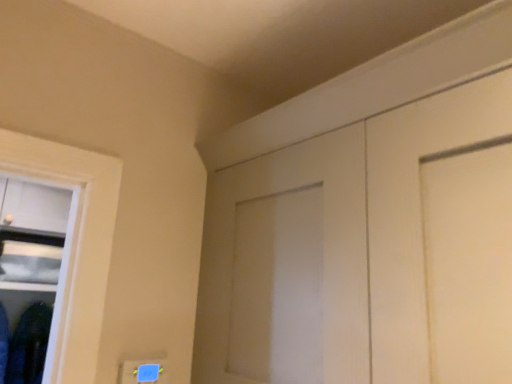
What are the coordinates of `white matte door at upper right` in the screenshot? It's located at (366, 251).

The image size is (512, 384). What do you see at coordinates (366, 251) in the screenshot? I see `white matte door at upper right` at bounding box center [366, 251].

What do you see at coordinates (29, 345) in the screenshot?
I see `dark blue fabric at lower left` at bounding box center [29, 345].

The height and width of the screenshot is (384, 512). I want to click on dark blue fabric at lower left, so click(29, 345).

You are a GUI agent. You are given a task and a screenshot of the screen. Output one action in this format:
    pyautogui.click(x=<x>, y=<y>)
    Task: Click on the white matte door at upper right
    The width and height of the screenshot is (512, 384).
    Given the screenshot: What is the action you would take?
    pyautogui.click(x=366, y=251)

Considering the relative positions of dark blue fabric at lower left and white matte door at upper right in the image provided, is dark blue fabric at lower left to the right of white matte door at upper right from the viewer's perspective?

No.

Considering their positions, is dark blue fabric at lower left located in front of or behind white matte door at upper right?

In the image, dark blue fabric at lower left appears behind white matte door at upper right.

Is point (23, 363) in front of point (426, 260)?

No, (23, 363) is behind (426, 260).

From the image's perspective, does dark blue fabric at lower left appear higher than white matte door at upper right?

No.

From a real-world perspective, is dark blue fabric at lower left on white matte door at upper right?

No.

Does dark blue fabric at lower left have a greater width compared to white matte door at upper right?

Incorrect, the width of dark blue fabric at lower left does not surpass that of white matte door at upper right.

Considering the relative sizes of dark blue fabric at lower left and white matte door at upper right in the image provided, is dark blue fabric at lower left shorter than white matte door at upper right?

Indeed, dark blue fabric at lower left has a lesser height compared to white matte door at upper right.

From the picture: Considering the relative sizes of dark blue fabric at lower left and white matte door at upper right in the image provided, is dark blue fabric at lower left smaller than white matte door at upper right?

Correct, dark blue fabric at lower left occupies less space than white matte door at upper right.

Is white matte door at upper right surrounded by dark blue fabric at lower left?

No, white matte door at upper right is not inside dark blue fabric at lower left.

Are dark blue fabric at lower left and white matte door at upper right located far from each other?

Absolutely, dark blue fabric at lower left is distant from white matte door at upper right.

Is dark blue fabric at lower left facing towards white matte door at upper right?

Yes, dark blue fabric at lower left is turned towards white matte door at upper right.

How much distance is there between dark blue fabric at lower left and white matte door at upper right?

They are 2.10 meters apart.

Where is `clothing located on the left of white matte door at upper right`? The width and height of the screenshot is (512, 384). clothing located on the left of white matte door at upper right is located at coordinates (29, 345).

Which object is positioned more to the right, white matte door at upper right or dark blue fabric at lower left?

From the viewer's perspective, white matte door at upper right appears more on the right side.

Which object is further away from the camera, white matte door at upper right or dark blue fabric at lower left?

dark blue fabric at lower left.

Which is behind, point (227, 259) or point (9, 378)?

The point (9, 378) is behind.

From the image's perspective, is white matte door at upper right positioned above or below dark blue fabric at lower left?

From the image's perspective, white matte door at upper right appears above dark blue fabric at lower left.

From a real-world perspective, is white matte door at upper right physically above dark blue fabric at lower left?

Yes.

Which of these two, white matte door at upper right or dark blue fabric at lower left, is wider?

With larger width is white matte door at upper right.

Can you confirm if white matte door at upper right is shorter than dark blue fabric at lower left?

No, white matte door at upper right is not shorter than dark blue fabric at lower left.

Is white matte door at upper right smaller than dark blue fabric at lower left?

Incorrect, white matte door at upper right is not smaller in size than dark blue fabric at lower left.

Is white matte door at upper right located outside dark blue fabric at lower left?

white matte door at upper right lies outside dark blue fabric at lower left's area.

Can you see white matte door at upper right touching dark blue fabric at lower left?

white matte door at upper right is not next to dark blue fabric at lower left, and they're not touching.

Is white matte door at upper right facing away from dark blue fabric at lower left?

white matte door at upper right does not have its back to dark blue fabric at lower left.

How many degrees apart are the facing directions of white matte door at upper right and dark blue fabric at lower left?

The angular difference between white matte door at upper right and dark blue fabric at lower left is 90.6 degrees.

Find the location of a particular element. Image resolution: width=512 pixels, height=384 pixels. clothing beneath the white matte door at upper right (from a real-world perspective) is located at coordinates (29, 345).

Image resolution: width=512 pixels, height=384 pixels. I want to click on door in front of the dark blue fabric at lower left, so click(366, 251).

Locate an element on the screen. clothing below the white matte door at upper right (from the image's perspective) is located at coordinates (29, 345).